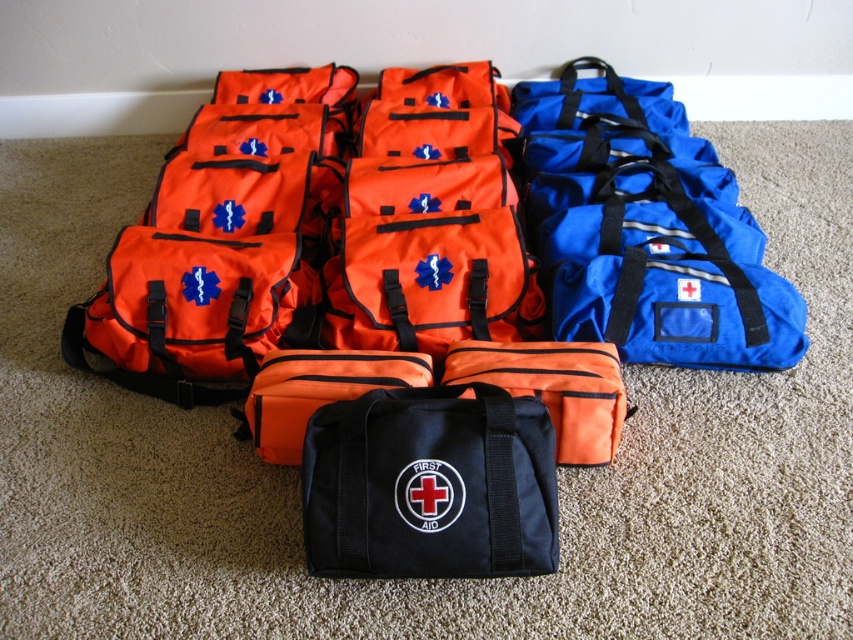
You need to place both the orange fabric first aid kit at center and the black fabric first aid kit at center onto a shelf that can only hold items up to 1 meter in width. Based on their widths, can both fit side by side?

The orange fabric first aid kit at center might be wider than black fabric first aid kit at center, so it is uncertain if both can fit side by side on the shelf. The combined width of both items may exceed the 1 meter limit.